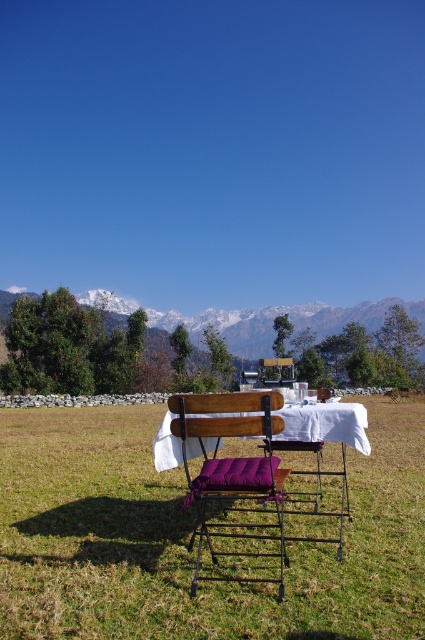
Looking at this image, you are standing at the viewer position in the image and want to reach the point labeled as point [150,314]. If your walking speed is 1.5 meters per second, how many seconds will it take you to reach that point?

The distance between the viewer and point [150,314] is 117.38 meters. At a walking speed of 1.5 meters per second, it would take approximately 78.25 seconds to reach the point.